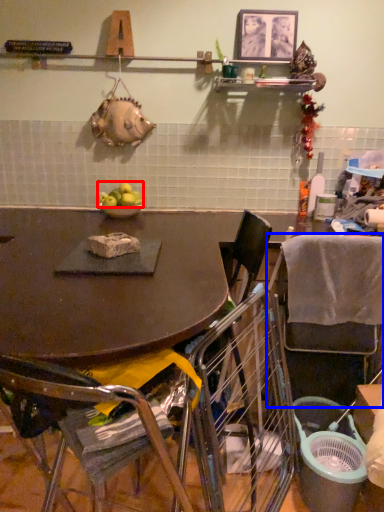
Question: Which object appears farthest to the camera in this image, apple (highlighted by a red box) or chair (highlighted by a blue box)?

Choices:
 (A) apple
 (B) chair

Answer: (A)